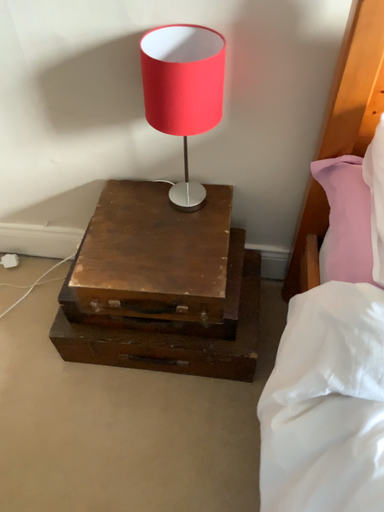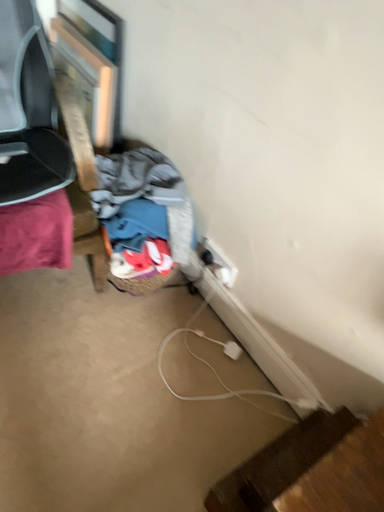
Question: Which way did the camera rotate in the video?

Choices:
 (A) rotated right
 (B) rotated left

Answer: (B)